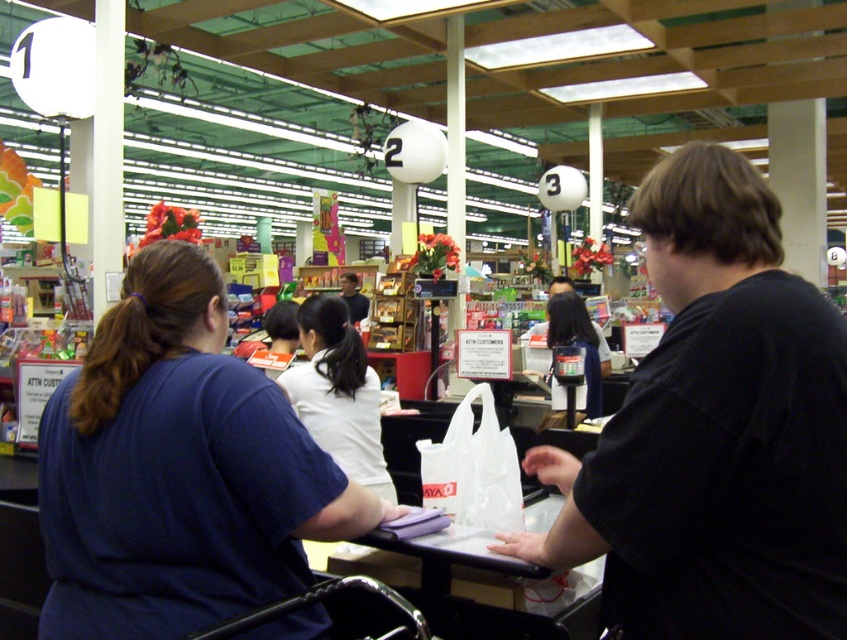
You are a customer in the store and you see the white matte shirt at center and the matte black purse at center. Which one is closer to the left side of the store?

The white matte shirt at center is to the left of the matte black purse at center, so it is closer to the left side of the store.

You are standing at the entrance of the store and looking towards the checkout counter. Where would you see the white matte shirt at center located in terms of direction and distance?

The white matte shirt at center is located at coordinates approximately 0.614 on the x axis and 0.400 on the y axis from your viewpoint at the entrance.